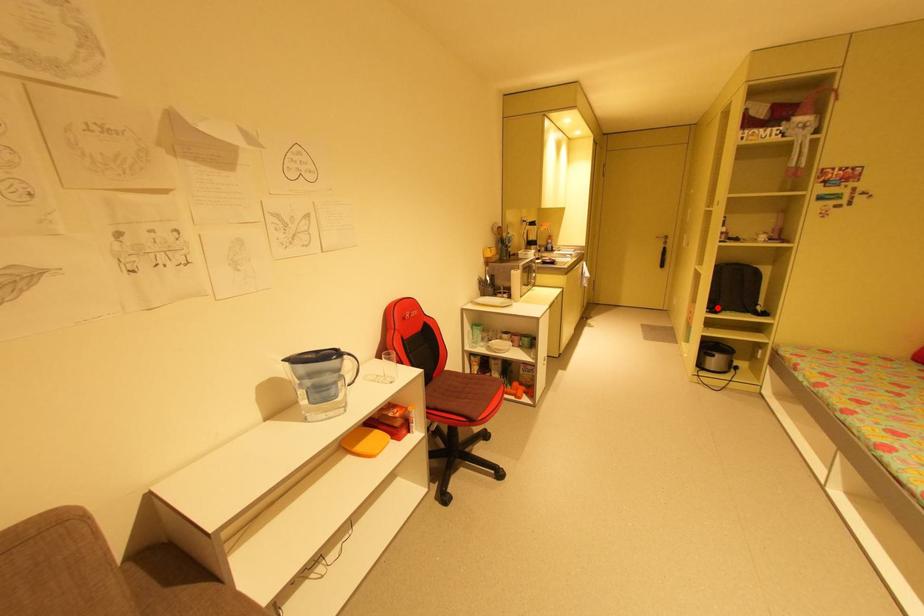
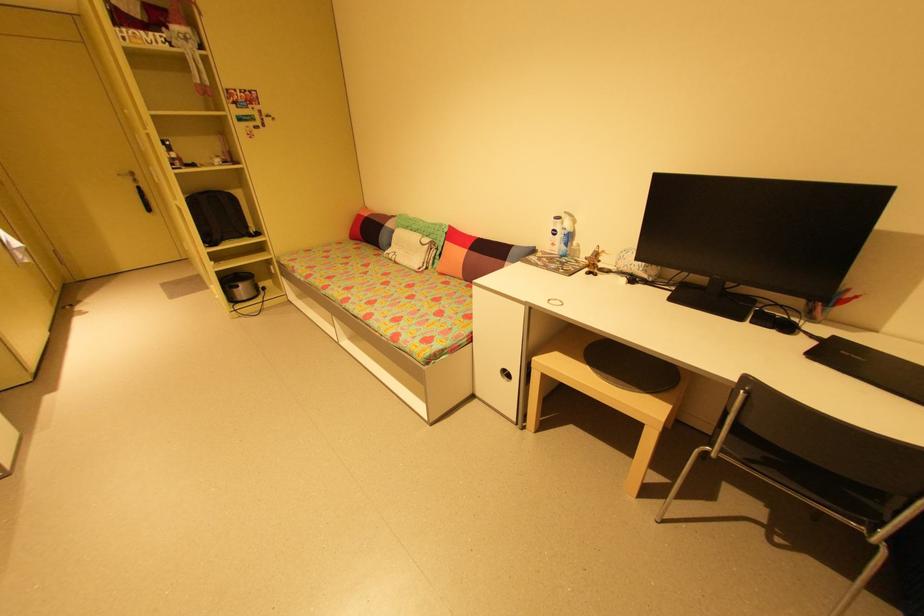
Question: I am providing you with two images of the same scene from different viewpoints. Given a red point in image1, look at the same physical point in image2. Is it:

Choices:
 (A) Closer to the viewpoint
 (B) Farther from the viewpoint

Answer: (B)